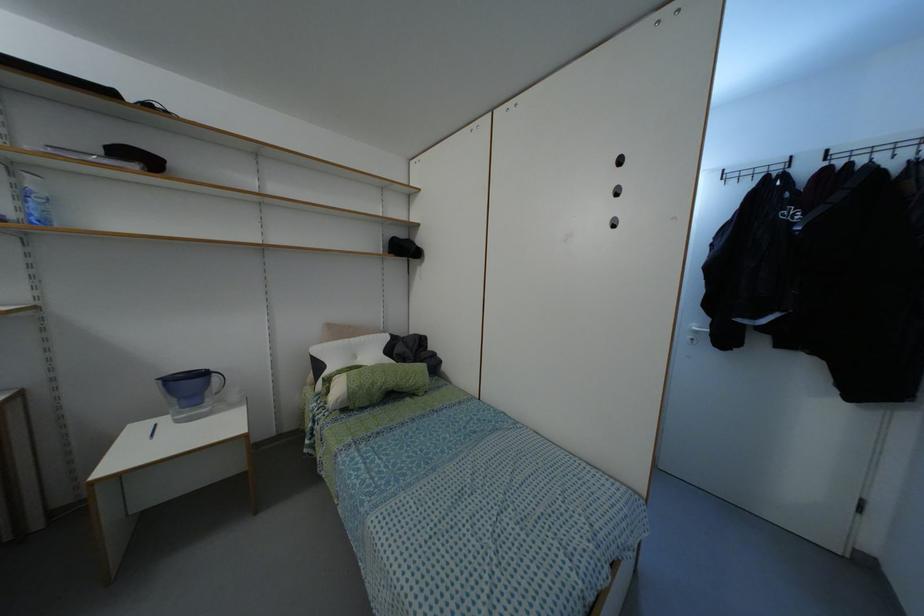
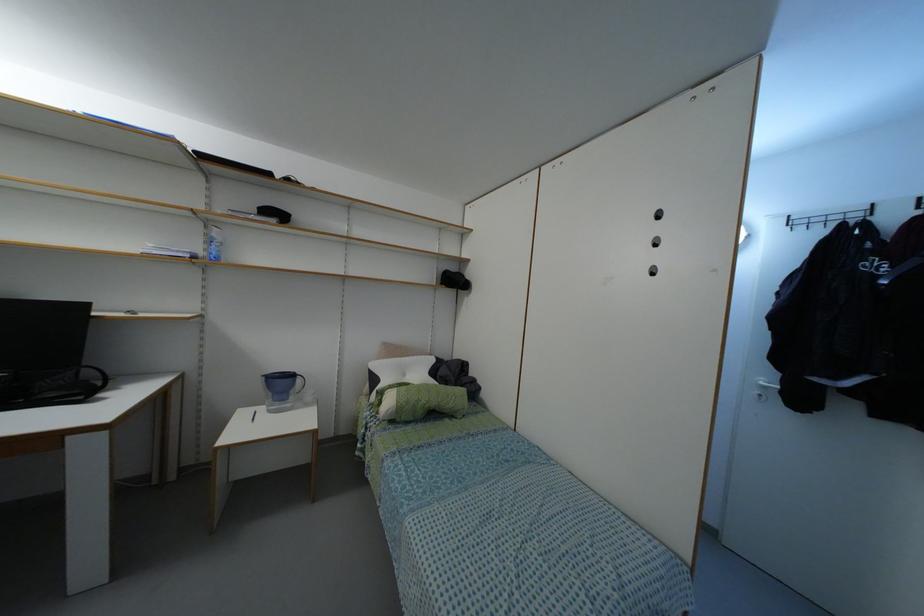
Locate, in the second image, the point that corresponds to point 44,222 in the first image.

(216, 257)